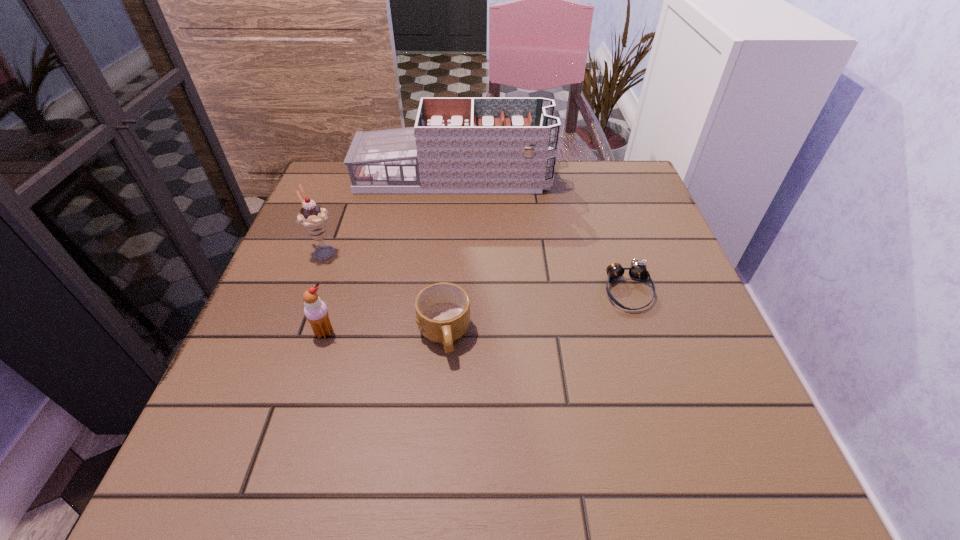
The image size is (960, 540). In order to click on free space between the mug and the goggles in this screenshot , I will do `click(536, 313)`.

The width and height of the screenshot is (960, 540). I want to click on free space that is in between the farther icecream and the goggles, so click(x=475, y=272).

Find the location of `vacant space that's between the shortest object and the third shortest object`. vacant space that's between the shortest object and the third shortest object is located at coordinates (476, 312).

Image resolution: width=960 pixels, height=540 pixels. I want to click on free space between the shortest object and the right icecream, so click(x=476, y=312).

The image size is (960, 540). I want to click on object that stands as the fourth closest to the shortest object, so click(x=312, y=217).

Locate an element on the screen. The width and height of the screenshot is (960, 540). object that ranks as the third closest to the third tallest object is located at coordinates point(458,145).

Find the location of a particular element. The height and width of the screenshot is (540, 960). free space that satisfies the following two spatial constraints: 1. at the entrance of the farthest object; 2. at the front with a straw on the shorter icecream is located at coordinates (441, 333).